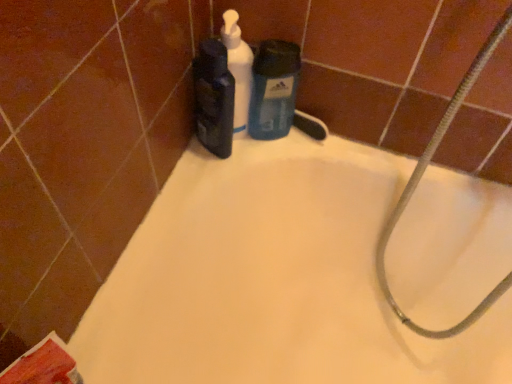
Question: From the image's perspective, is white matte pump bottle at upper center, acting as the 2th cleaning product starting from the right, under blue matte liquid soap at center, which is the 3th cleaning product in left-to-right order?

Choices:
 (A) no
 (B) yes

Answer: (A)

Question: Is white matte pump bottle at upper center, acting as the 2th cleaning product starting from the right, located outside blue matte liquid soap at center, which is the 3th cleaning product in left-to-right order?

Choices:
 (A) no
 (B) yes

Answer: (B)

Question: Does white matte pump bottle at upper center, acting as the 2th cleaning product starting from the right, have a greater height compared to blue matte liquid soap at center, which is the 3th cleaning product in left-to-right order?

Choices:
 (A) yes
 (B) no

Answer: (A)

Question: Is white matte pump bottle at upper center, acting as the 2th cleaning product starting from the right, next to blue matte liquid soap at center, which is the 3th cleaning product in left-to-right order, and touching it?

Choices:
 (A) no
 (B) yes

Answer: (B)

Question: Considering the relative positions of white matte pump bottle at upper center, acting as the 2th cleaning product starting from the right, and blue matte liquid soap at center, which is the 3th cleaning product in left-to-right order, in the image provided, is white matte pump bottle at upper center, acting as the 2th cleaning product starting from the right, to the left of blue matte liquid soap at center, which is the 3th cleaning product in left-to-right order, from the viewer's perspective?

Choices:
 (A) no
 (B) yes

Answer: (B)

Question: Is white matte pump bottle at upper center, acting as the 2th cleaning product starting from the right, oriented away from blue matte liquid soap at center, which is the 3th cleaning product in left-to-right order?

Choices:
 (A) no
 (B) yes

Answer: (A)

Question: Does matte black bottle at upper center, the third cleaning product in the right-to-left sequence, come behind white matte bathtub at upper center?

Choices:
 (A) yes
 (B) no

Answer: (A)

Question: Can you confirm if matte black bottle at upper center, the third cleaning product in the right-to-left sequence, is positioned to the left of white matte bathtub at upper center?

Choices:
 (A) no
 (B) yes

Answer: (B)

Question: Is matte black bottle at upper center, acting as the first cleaning product starting from the left, to the right of white matte bathtub at upper center from the viewer's perspective?

Choices:
 (A) yes
 (B) no

Answer: (B)

Question: From a real-world perspective, is matte black bottle at upper center, the third cleaning product in the right-to-left sequence, over white matte bathtub at upper center?

Choices:
 (A) yes
 (B) no

Answer: (A)

Question: Considering the relative sizes of matte black bottle at upper center, acting as the first cleaning product starting from the left, and white matte bathtub at upper center in the image provided, is matte black bottle at upper center, acting as the first cleaning product starting from the left, shorter than white matte bathtub at upper center?

Choices:
 (A) yes
 (B) no

Answer: (A)

Question: Is white matte bathtub at upper center far from silvery metallic hose at upper right?

Choices:
 (A) yes
 (B) no

Answer: (B)